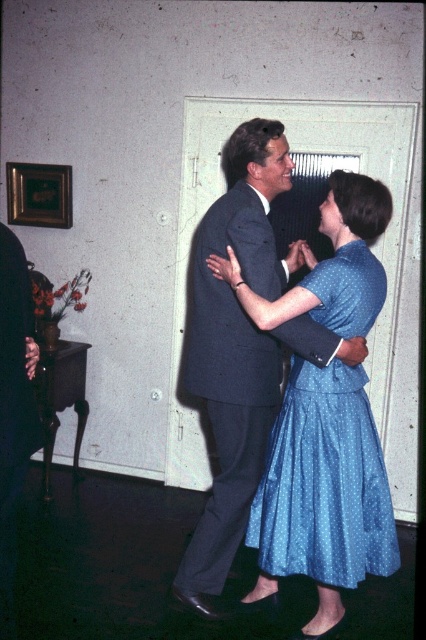
Question: Can you confirm if blue dotted dress at center is positioned above blue dotted fabric dress at center?

Choices:
 (A) yes
 (B) no

Answer: (A)

Question: Among these objects, which one is farthest from the camera?

Choices:
 (A) blue dotted fabric dress at center
 (B) blue dotted dress at center

Answer: (B)

Question: Which point appears closest to the camera in this image?

Choices:
 (A) (359, 275)
 (B) (255, 360)

Answer: (A)

Question: Which of the following is the closest to the observer?

Choices:
 (A) (331, 371)
 (B) (290, 321)

Answer: (B)

Question: Does blue dotted dress at center appear on the left side of blue dotted fabric dress at center?

Choices:
 (A) no
 (B) yes

Answer: (B)

Question: Does blue dotted dress at center appear on the right side of blue dotted fabric dress at center?

Choices:
 (A) yes
 (B) no

Answer: (B)